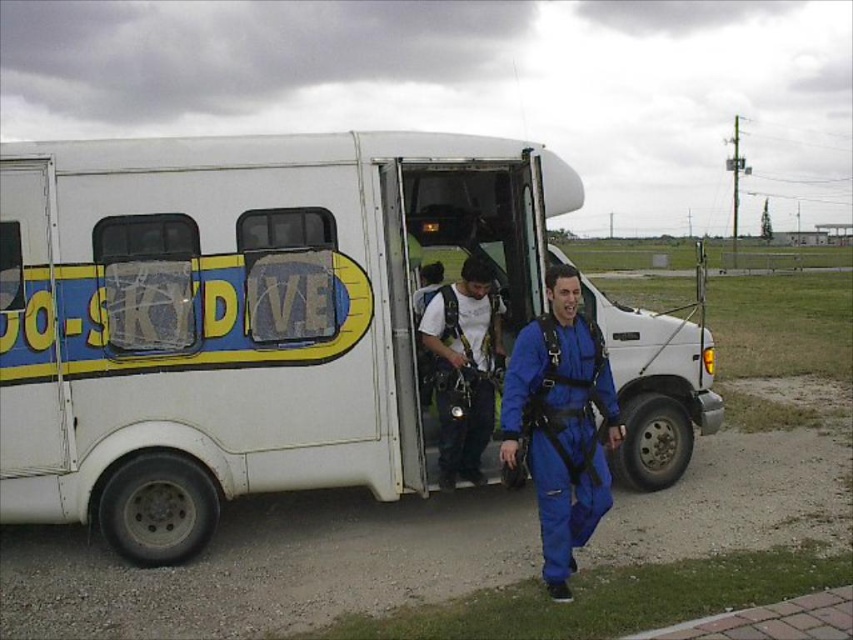
You are a photographer positioned to the left of the van. You want to take a photo of the blue matte jumpsuit at center and the blue fabric jumpsuit at center. Which one should you focus on first if you want to capture the one closer to the van?

The blue fabric jumpsuit at center is to the left of the blue matte jumpsuit at center, so it is closer to the photographer positioned to the left of the van. Focus on the blue fabric jumpsuit at center first.